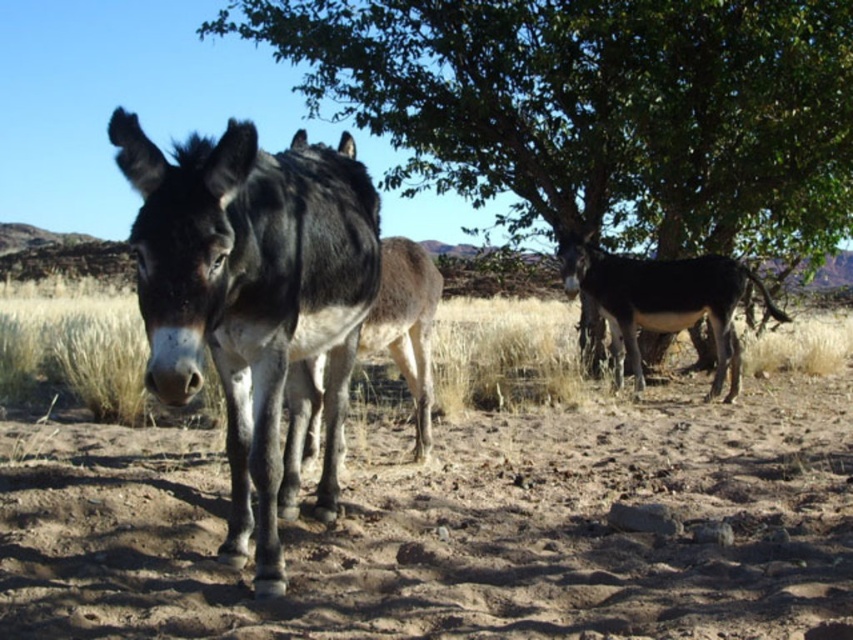
Question: Is brown sandy dirt at center positioned at the back of dark gray fur mule at center?

Choices:
 (A) no
 (B) yes

Answer: (B)

Question: Which of the following is the farthest from the observer?

Choices:
 (A) (728, 260)
 (B) (268, 397)
 (C) (552, 305)
 (D) (393, 67)

Answer: (C)

Question: Which object is farther from the camera taking this photo?

Choices:
 (A) dark gray fur mule at center
 (B) green leafy tree at center
 (C) brown sandy dirt at center
 (D) dark brown glossy mule at right

Answer: (B)

Question: Is the position of green leafy tree at center less distant than that of dark gray fur mule at center?

Choices:
 (A) yes
 (B) no

Answer: (B)

Question: Which object is the farthest from the dark gray fur mule at center?

Choices:
 (A) green leafy tree at center
 (B) dark brown glossy mule at right

Answer: (A)

Question: Does brown sandy dirt at center appear on the right side of dark gray fur mule at center?

Choices:
 (A) no
 (B) yes

Answer: (B)